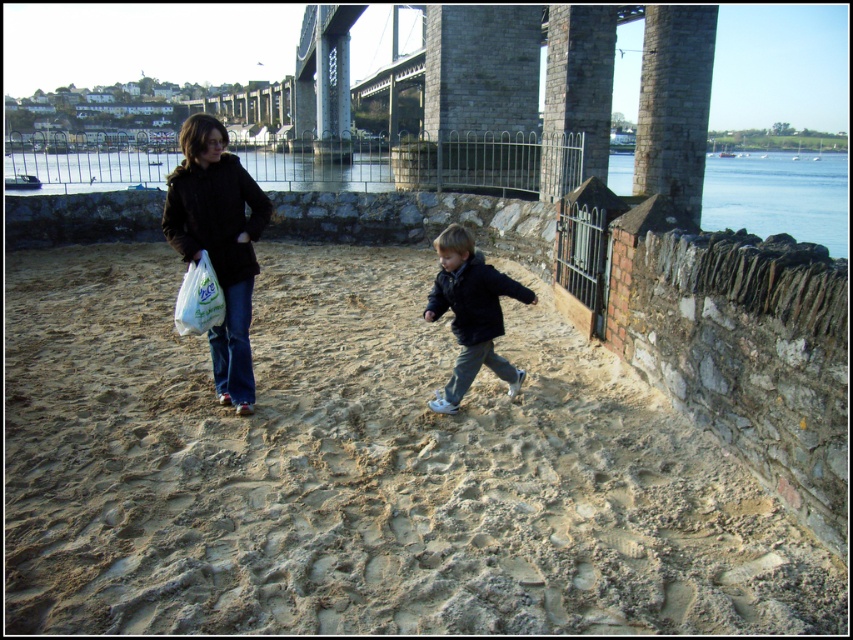
You are standing at the coordinates mentioned in the scene description. Which direction should you walk to reach the brown sandy beach at center?

The brown sandy beach at center is located at point (363, 470), so you should walk towards the coordinates provided to reach it.

From the picture: You are standing at the point marked by coordinates (215, 216) in the image. Looking around, you see a black matte jacket at upper left and other objects in the scene. Which direction should you face to look directly at the black matte jacket at upper left?

You are already facing the black matte jacket at upper left because the point is on it according to the description.